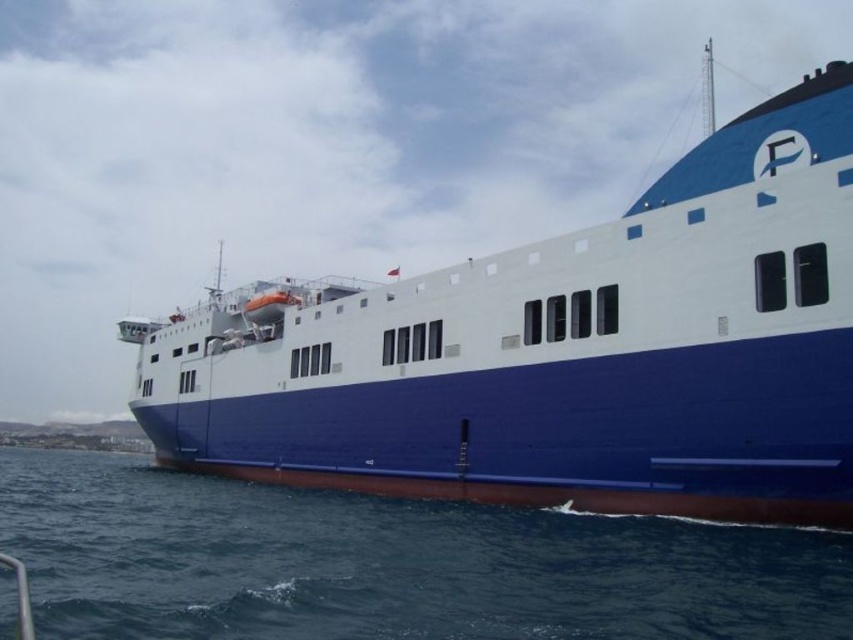
Question: Is blue matte ship at center positioned at the back of blue smooth water at lower center?

Choices:
 (A) yes
 (B) no

Answer: (A)

Question: Among these objects, which one is nearest to the camera?

Choices:
 (A) blue smooth water at lower center
 (B) blue matte ship at center

Answer: (A)

Question: Among these objects, which one is nearest to the camera?

Choices:
 (A) blue smooth water at lower center
 (B) blue matte ship at center

Answer: (A)

Question: Does blue matte ship at center have a greater width compared to blue smooth water at lower center?

Choices:
 (A) yes
 (B) no

Answer: (A)

Question: Does blue matte ship at center come in front of blue smooth water at lower center?

Choices:
 (A) yes
 (B) no

Answer: (B)